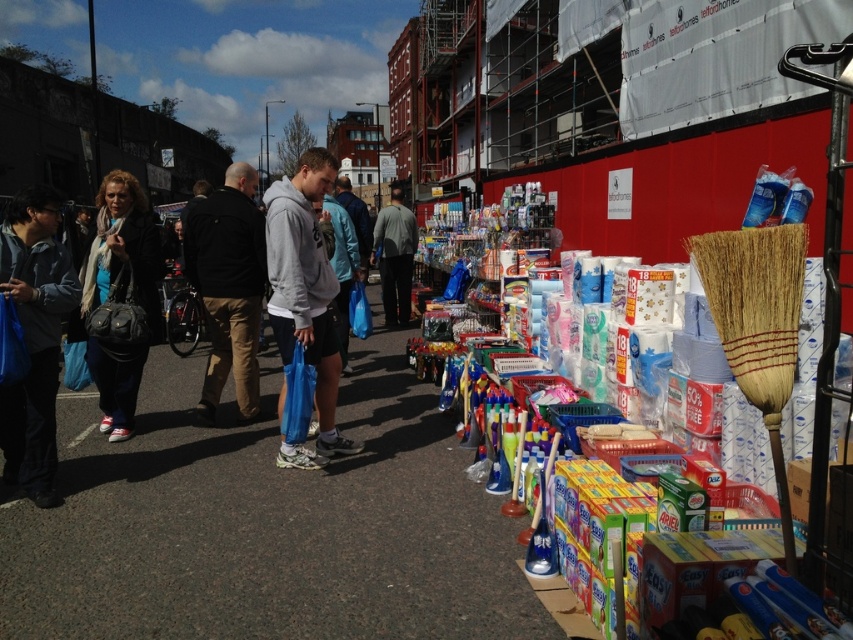
Between blue fabric bag at left and black cotton jacket at center, which one appears on the right side from the viewer's perspective?

black cotton jacket at center

In the scene shown: Does blue fabric bag at left appear on the right side of black cotton jacket at center?

Incorrect, blue fabric bag at left is not on the right side of black cotton jacket at center.

This screenshot has height=640, width=853. What are the coordinates of `blue fabric bag at left` in the screenshot? It's located at click(33, 339).

Between gray matte hoodie at center and black leather handbag at left, which one is positioned higher?

gray matte hoodie at center is higher up.

Does gray matte hoodie at center have a larger size compared to black leather handbag at left?

No.

Image resolution: width=853 pixels, height=640 pixels. What do you see at coordinates (305, 298) in the screenshot?
I see `gray matte hoodie at center` at bounding box center [305, 298].

This screenshot has height=640, width=853. Find the location of `gray matte hoodie at center`. gray matte hoodie at center is located at coordinates (305, 298).

Can you confirm if gray matte hoodie at center is thinner than gray fabric jacket at center?

Indeed, gray matte hoodie at center has a lesser width compared to gray fabric jacket at center.

Between point (300, 250) and point (383, 220), which one is positioned in front?

Point (300, 250) is in front.

Where is `gray matte hoodie at center`? gray matte hoodie at center is located at coordinates (305, 298).